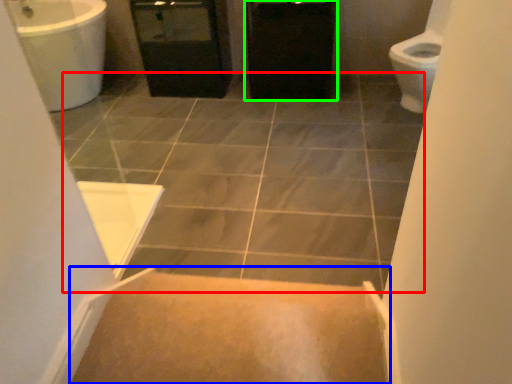
Question: Considering the real-world distances, which object is farthest from ceramic tile (highlighted by a red box)? stairs (highlighted by a blue box) or cabinetry (highlighted by a green box)?

Choices:
 (A) stairs
 (B) cabinetry

Answer: (A)